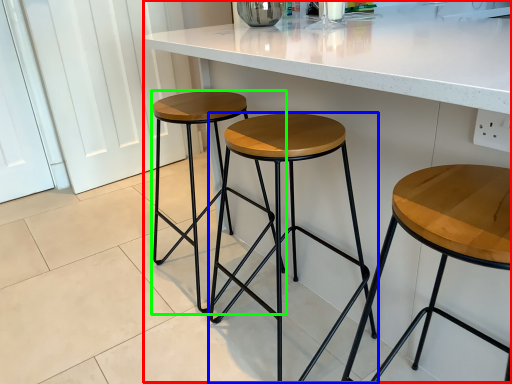
Question: Based on their relative distances, which object is nearer to counter (highlighted by a red box)? Choose from stool (highlighted by a blue box) and stool (highlighted by a green box).

Choices:
 (A) stool
 (B) stool

Answer: (A)